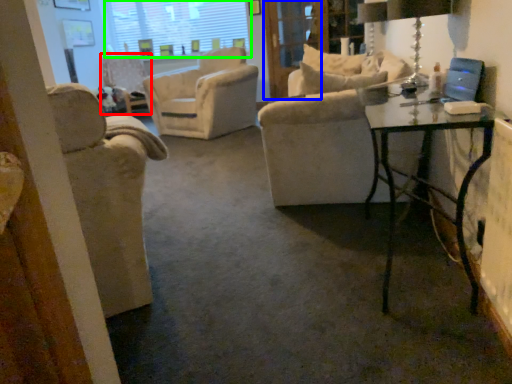
Question: Which object is positioned closest to chair (highlighted by a red box)? Select from screen door (highlighted by a blue box) and window screen (highlighted by a green box).

Choices:
 (A) screen door
 (B) window screen

Answer: (B)